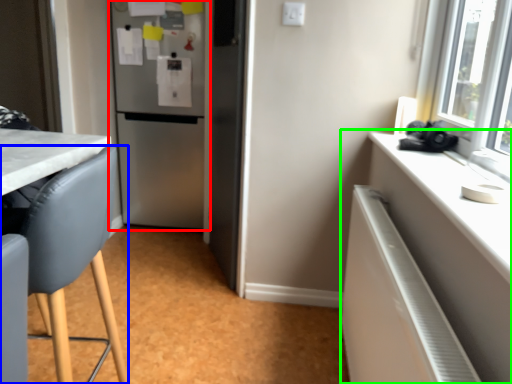
Question: Considering the real-world distances, which object is farthest from refrigerator (highlighted by a red box)? chair (highlighted by a blue box) or cabinetry (highlighted by a green box)?

Choices:
 (A) chair
 (B) cabinetry

Answer: (B)